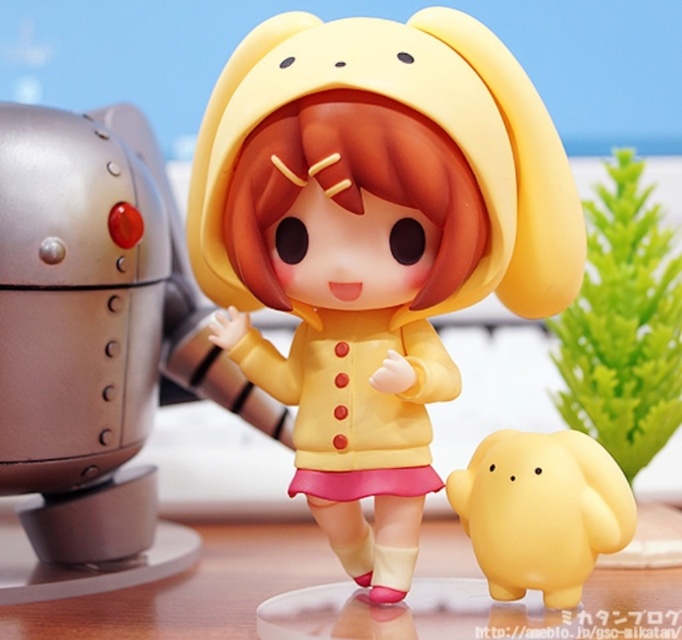
Question: Considering the real-world distances, which object is farthest from the brushed metal robot at left?

Choices:
 (A) yellow matte plush at center
 (B) yellow matte doll at center

Answer: (A)

Question: Which point is farther to the camera?

Choices:
 (A) yellow matte doll at center
 (B) yellow matte plush at center
 (C) brushed metal robot at left

Answer: (C)

Question: Does yellow matte doll at center appear on the right side of glossy plastic table at lower center?

Choices:
 (A) yes
 (B) no

Answer: (A)

Question: Does yellow matte doll at center appear on the right side of yellow matte plush at center?

Choices:
 (A) no
 (B) yes

Answer: (A)

Question: Among these objects, which one is nearest to the camera?

Choices:
 (A) glossy plastic table at lower center
 (B) brushed metal robot at left

Answer: (A)

Question: Is brushed metal robot at left thinner than yellow matte plush at center?

Choices:
 (A) no
 (B) yes

Answer: (A)